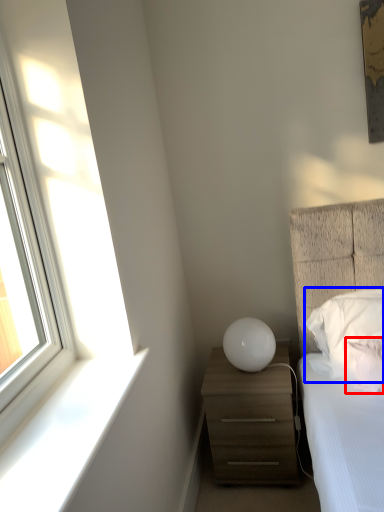
Question: Which point is closer to the camera, pillow (highlighted by a red box) or pillow (highlighted by a blue box)?

Choices:
 (A) pillow
 (B) pillow

Answer: (A)